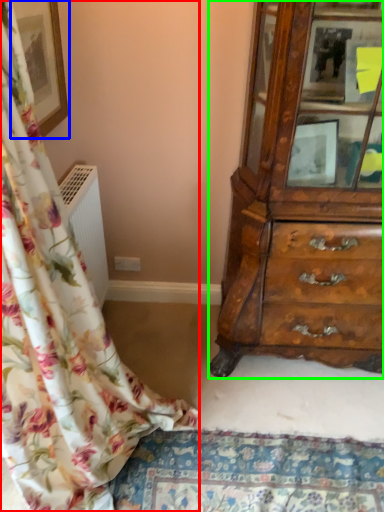
Question: Which is farther away from curtain (highlighted by a red box)? picture frame (highlighted by a blue box) or chest of drawers (highlighted by a green box)?

Choices:
 (A) picture frame
 (B) chest of drawers

Answer: (B)